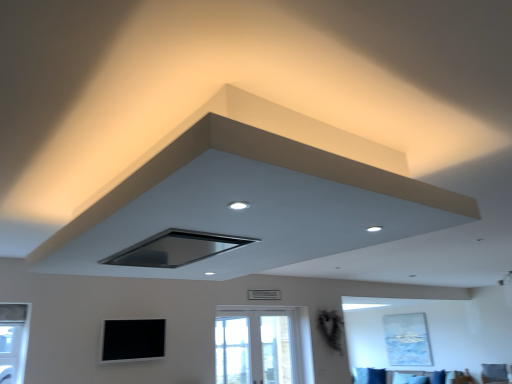
Question: Is black matte window screen at lower center shorter than velvet blue sofa at lower center?

Choices:
 (A) no
 (B) yes

Answer: (A)

Question: From a real-world perspective, is black matte window screen at lower center physically below velvet blue sofa at lower center?

Choices:
 (A) no
 (B) yes

Answer: (A)

Question: Is black matte window screen at lower center at the left side of velvet blue sofa at lower center?

Choices:
 (A) no
 (B) yes

Answer: (B)

Question: Does black matte window screen at lower center have a lesser width compared to velvet blue sofa at lower center?

Choices:
 (A) yes
 (B) no

Answer: (A)

Question: Can you confirm if black matte window screen at lower center is bigger than velvet blue sofa at lower center?

Choices:
 (A) no
 (B) yes

Answer: (A)

Question: Does black matte window screen at lower center have a greater width compared to velvet blue sofa at lower center?

Choices:
 (A) no
 (B) yes

Answer: (A)

Question: Is black matte exhaust hood at center, marked as the 2th exhaust hood in a right-to-left arrangement, with black matte window screen at lower center?

Choices:
 (A) yes
 (B) no

Answer: (B)

Question: Is black matte exhaust hood at center, positioned as the first exhaust hood in left-to-right order, further to the viewer compared to black matte window screen at lower center?

Choices:
 (A) no
 (B) yes

Answer: (A)

Question: Does black matte exhaust hood at center, positioned as the first exhaust hood in left-to-right order, have a lesser height compared to black matte window screen at lower center?

Choices:
 (A) no
 (B) yes

Answer: (B)

Question: Considering the relative sizes of black matte exhaust hood at center, positioned as the first exhaust hood in left-to-right order, and black matte window screen at lower center in the image provided, is black matte exhaust hood at center, positioned as the first exhaust hood in left-to-right order, bigger than black matte window screen at lower center?

Choices:
 (A) yes
 (B) no

Answer: (A)

Question: Can you confirm if black matte exhaust hood at center, marked as the 2th exhaust hood in a right-to-left arrangement, is smaller than black matte window screen at lower center?

Choices:
 (A) yes
 (B) no

Answer: (B)

Question: Is black matte exhaust hood at center, marked as the 2th exhaust hood in a right-to-left arrangement, not within black matte window screen at lower center?

Choices:
 (A) yes
 (B) no

Answer: (A)

Question: From a real-world perspective, is white glass window at center physically below matte black exhaust hood at upper center, which ranks as the second exhaust hood in left-to-right order?

Choices:
 (A) no
 (B) yes

Answer: (B)